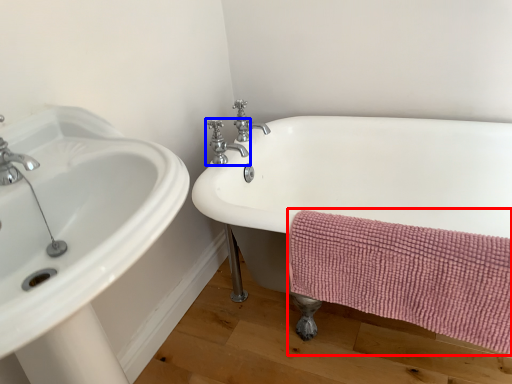
Question: Which object appears closest to the camera in this image, bath towel (highlighted by a red box) or tap (highlighted by a blue box)?

Choices:
 (A) bath towel
 (B) tap

Answer: (A)